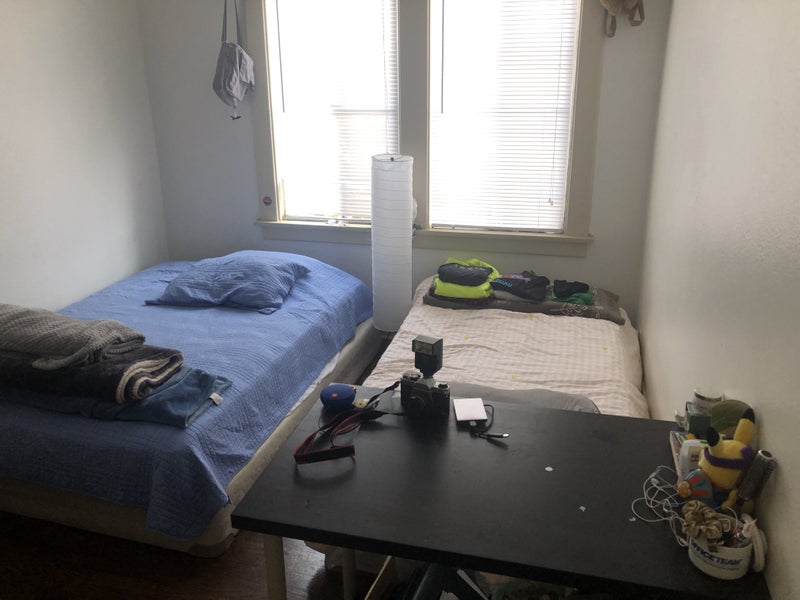
Find the location of a particular element. This screenshot has height=600, width=800. table is located at coordinates (562, 505).